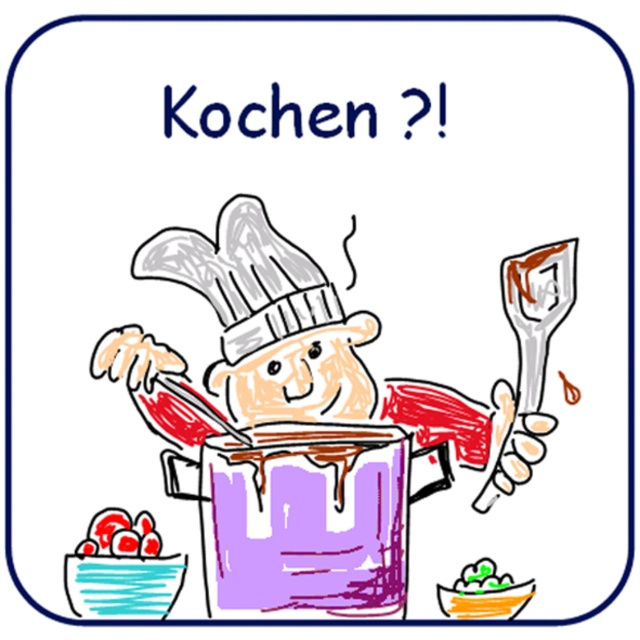
Question: Where is smooth red chef at center located in relation to green matte bowl at lower center in the image?

Choices:
 (A) right
 (B) left

Answer: (B)

Question: Which of these objects is positioned closest to the green matte bowl at lower center?

Choices:
 (A) smooth red tomatoes at lower left
 (B) smooth red chef at center

Answer: (B)

Question: Does smooth red chef at center have a smaller size compared to smooth red tomatoes at lower left?

Choices:
 (A) no
 (B) yes

Answer: (A)

Question: Which of the following is the farthest from the observer?

Choices:
 (A) smooth red chef at center
 (B) green matte bowl at lower center
 (C) smooth red tomatoes at lower left

Answer: (B)

Question: Which point is closer to the camera?

Choices:
 (A) smooth red tomatoes at lower left
 (B) green matte bowl at lower center

Answer: (A)

Question: Is green matte bowl at lower center behind smooth red tomatoes at lower left?

Choices:
 (A) no
 (B) yes

Answer: (B)